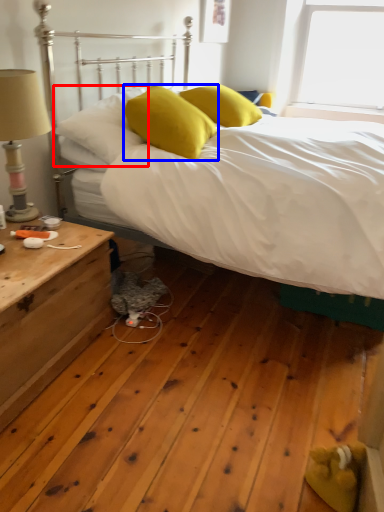
Question: Among these objects, which one is farthest to the camera, pillow (highlighted by a red box) or pillow (highlighted by a blue box)?

Choices:
 (A) pillow
 (B) pillow

Answer: (A)